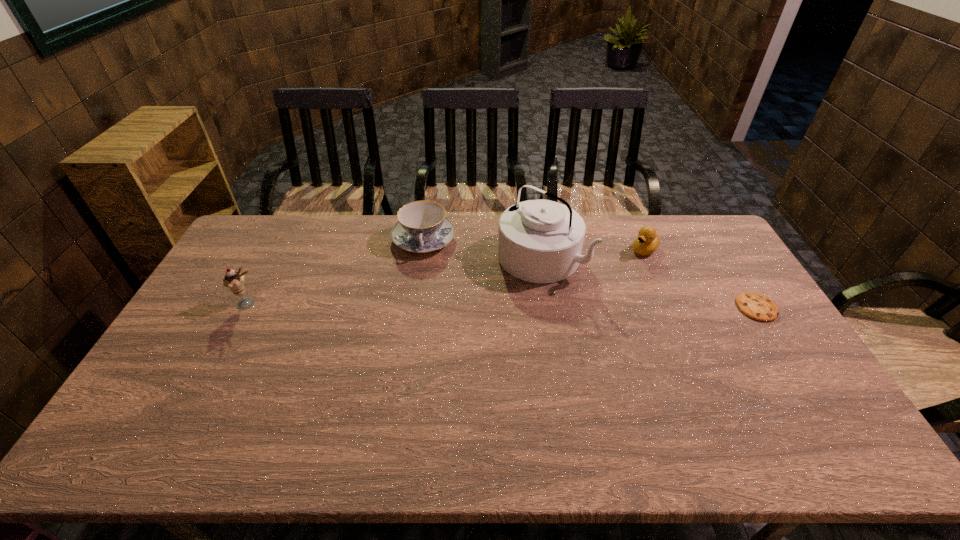
At what (x,y) coordinates should I click in order to perform the action: click on free space on the desktop that is between the fourth shortest object and the cookie and is positioned with the handle on the side of the second object from left to right. Please return your answer as a coordinate pair (x, y). The image size is (960, 540). Looking at the image, I should click on (426, 305).

The width and height of the screenshot is (960, 540). I want to click on vacant spot on the desktop that is between the fourth shortest object and the cookie and is positioned facing forward on the second object from right to left, so click(x=576, y=307).

You are a GUI agent. You are given a task and a screenshot of the screen. Output one action in this format:
    pyautogui.click(x=<x>, y=<y>)
    Task: Click on the free space on the desktop that is between the leftmost object and the cookie and is positioned on the spout of the third object from right to left
    This screenshot has height=540, width=960.
    Given the screenshot: What is the action you would take?
    pyautogui.click(x=483, y=306)